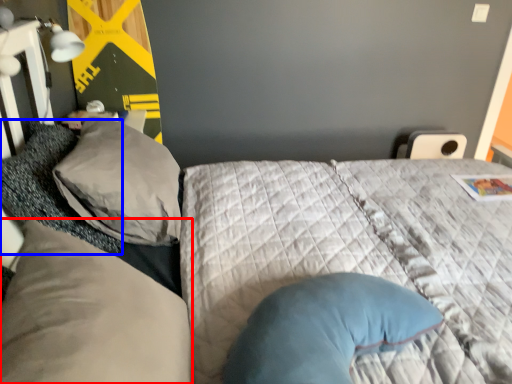
Question: Which object is closer to the camera taking this photo, pillow (highlighted by a red box) or pillow (highlighted by a blue box)?

Choices:
 (A) pillow
 (B) pillow

Answer: (A)